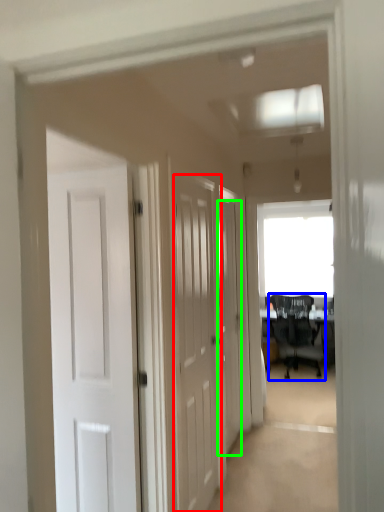
Question: Estimate the real-world distances between objects in this image. Which object is farther from door (highlighted by a red box), chair (highlighted by a blue box) or door (highlighted by a green box)?

Choices:
 (A) chair
 (B) door

Answer: (A)